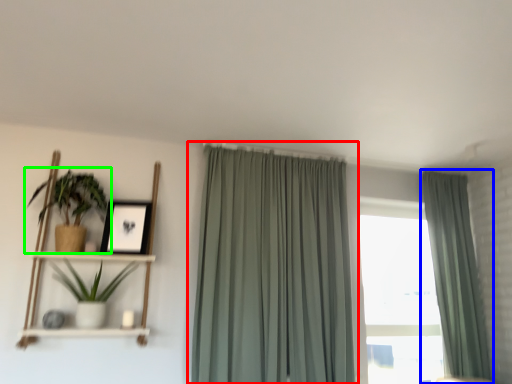
Question: Which object is positioned closest to curtain (highlighted by a red box)? Select from curtain (highlighted by a blue box) and houseplant (highlighted by a green box).

Choices:
 (A) curtain
 (B) houseplant

Answer: (B)